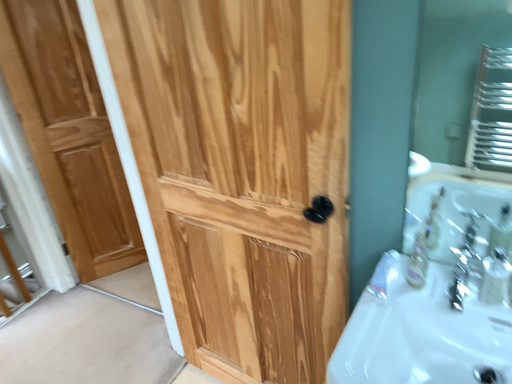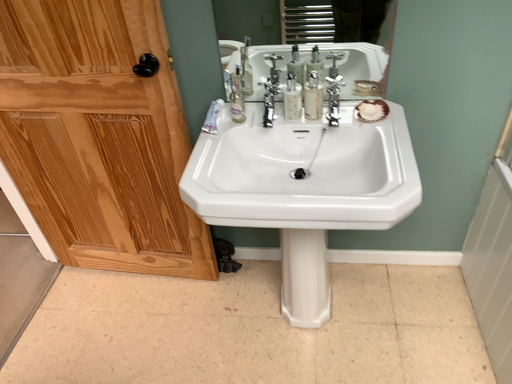
Question: Which way did the camera rotate in the video?

Choices:
 (A) rotated left
 (B) rotated right

Answer: (B)